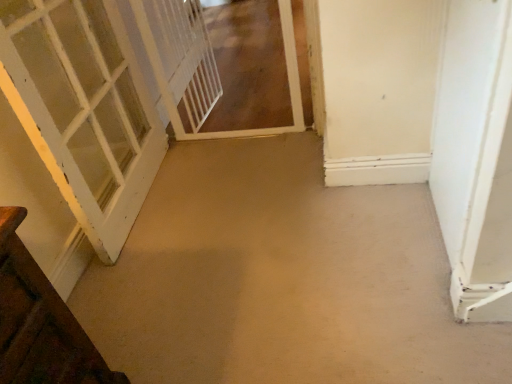
Where is `vacant space in front of white painted wood door at left, marked as the first door in a left-to-right arrangement`? This screenshot has width=512, height=384. vacant space in front of white painted wood door at left, marked as the first door in a left-to-right arrangement is located at coordinates click(x=168, y=270).